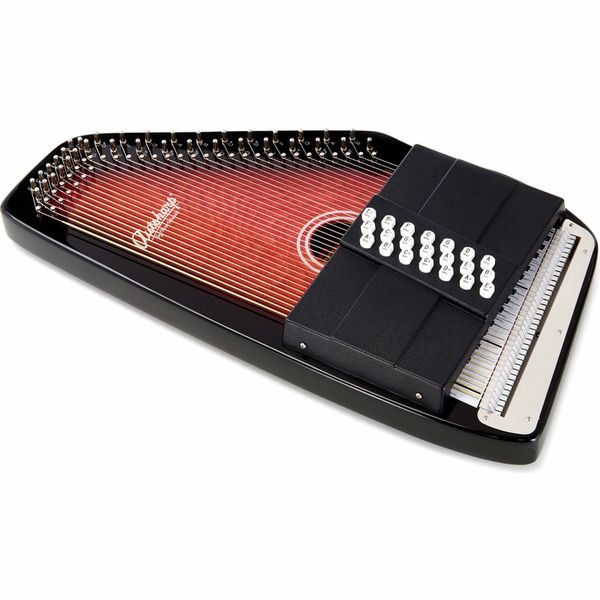
Where is `keys`? Image resolution: width=600 pixels, height=600 pixels. keys is located at coordinates (537, 257), (533, 282), (525, 297), (510, 310), (496, 336), (486, 354), (482, 375), (475, 385).